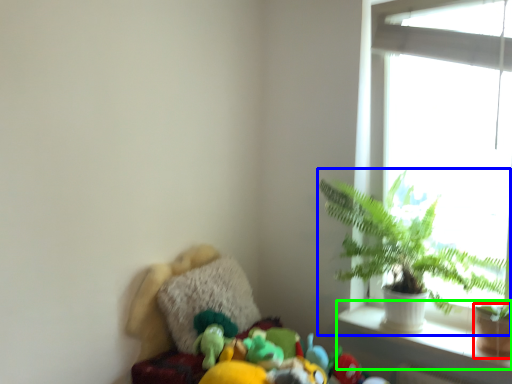
Question: Estimate the real-world distances between objects in this image. Which object is closer to flowerpot (highlighted by a red box), houseplant (highlighted by a blue box) or window sill (highlighted by a green box)?

Choices:
 (A) houseplant
 (B) window sill

Answer: (B)